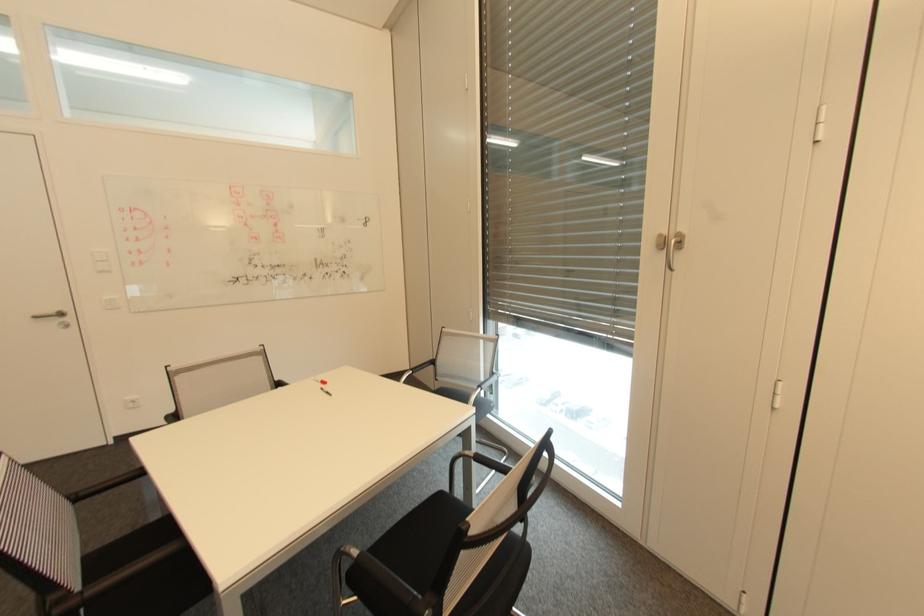
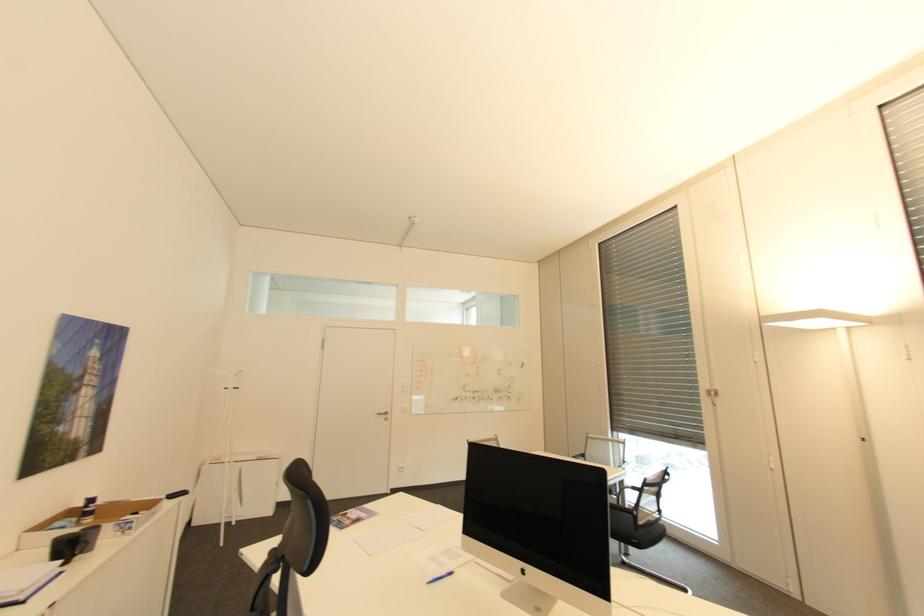
Locate, in the second image, the point that corresponds to point (67, 314) in the first image.

(391, 413)